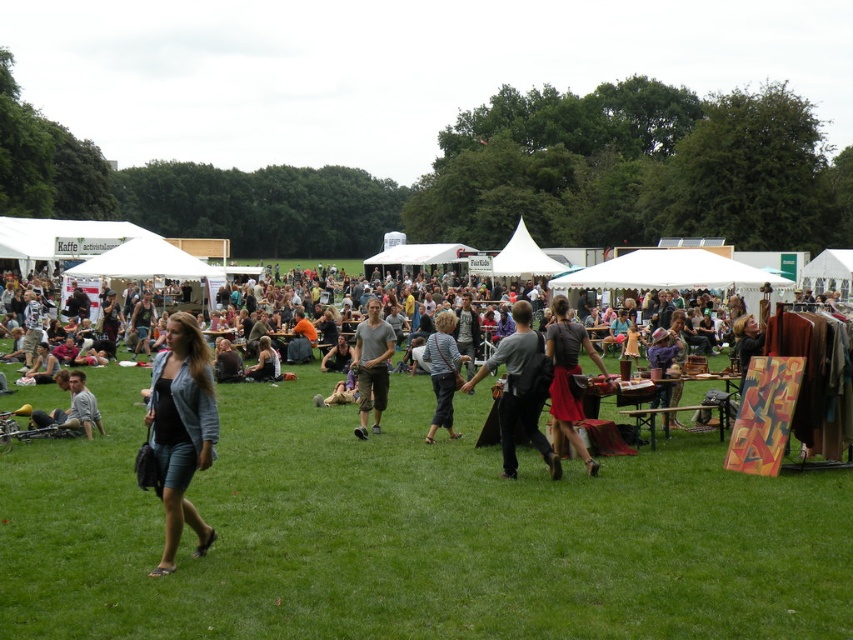
Is denim jacket at center below matte black dress at center?

Actually, denim jacket at center is above matte black dress at center.

In the scene shown: Can you confirm if denim jacket at center is bigger than matte black dress at center?

Indeed, denim jacket at center has a larger size compared to matte black dress at center.

What do you see at coordinates (682, 384) in the screenshot? The width and height of the screenshot is (853, 640). I see `denim jacket at center` at bounding box center [682, 384].

Identify the location of denim jacket at center. This screenshot has height=640, width=853. (682, 384).

Does dark gray backpack at center have a lesser height compared to striped shirt at center?

Correct, dark gray backpack at center is not as tall as striped shirt at center.

Is dark gray backpack at center to the right of striped shirt at center from the viewer's perspective?

Indeed, dark gray backpack at center is positioned on the right side of striped shirt at center.

Describe the element at coordinates (520, 388) in the screenshot. I see `dark gray backpack at center` at that location.

Identify the location of dark gray backpack at center. Image resolution: width=853 pixels, height=640 pixels. 520,388.

Does denim jacket at center have a lesser width compared to light brown leather jacket at lower left?

In fact, denim jacket at center might be wider than light brown leather jacket at lower left.

This screenshot has width=853, height=640. What do you see at coordinates (682, 384) in the screenshot? I see `denim jacket at center` at bounding box center [682, 384].

Between point (473, 378) and point (41, 416), which one is positioned in front?

Positioned in front is point (41, 416).

At what (x,y) coordinates should I click in order to perform the action: click on denim jacket at center. Please return your answer as a coordinate pair (x, y). Looking at the image, I should click on (682, 384).